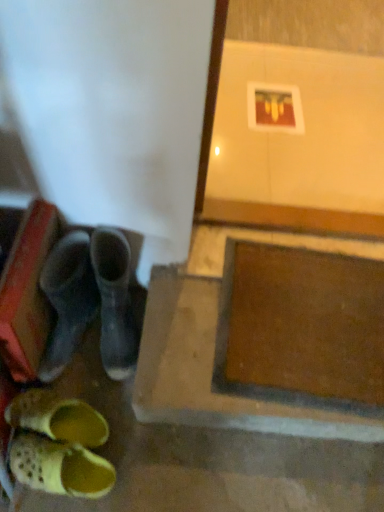
What are the coordinates of `vacant space behind yellow mesh clog at lower left` in the screenshot? It's located at (91, 408).